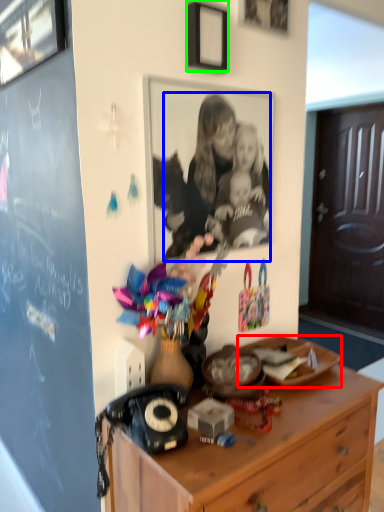
Question: Which is nearer to the plate (highlighted by a red box)? person (highlighted by a blue box) or picture frame (highlighted by a green box).

Choices:
 (A) person
 (B) picture frame

Answer: (A)